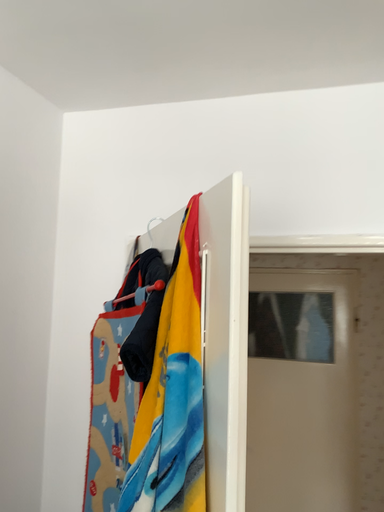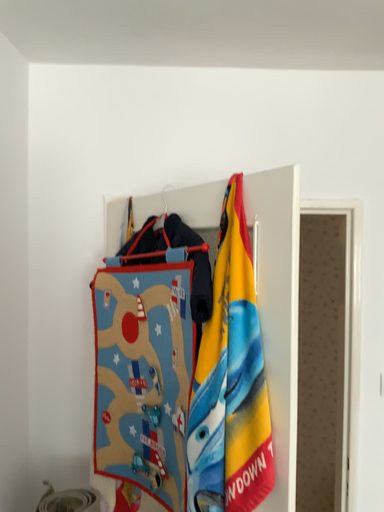
Question: How did the camera likely rotate when shooting the video?

Choices:
 (A) rotated left
 (B) rotated right

Answer: (B)